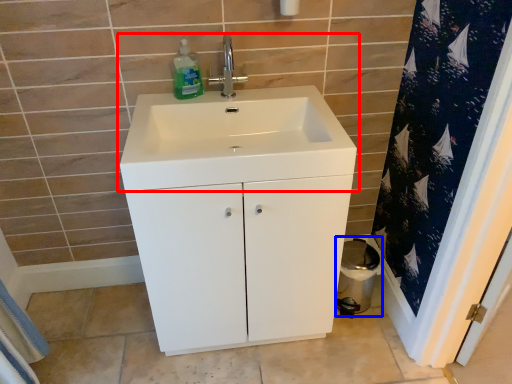
Question: Which object is closer to the camera taking this photo, sink (highlighted by a red box) or toilet bowl (highlighted by a blue box)?

Choices:
 (A) sink
 (B) toilet bowl

Answer: (A)